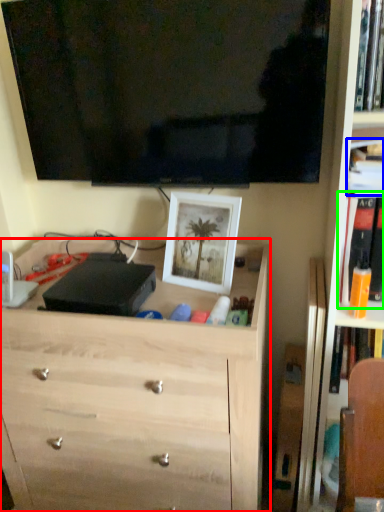
Question: Estimate the real-world distances between objects in this image. Which object is farther from chest of drawers (highlighted by a red box), book (highlighted by a blue box) or book (highlighted by a green box)?

Choices:
 (A) book
 (B) book

Answer: (A)